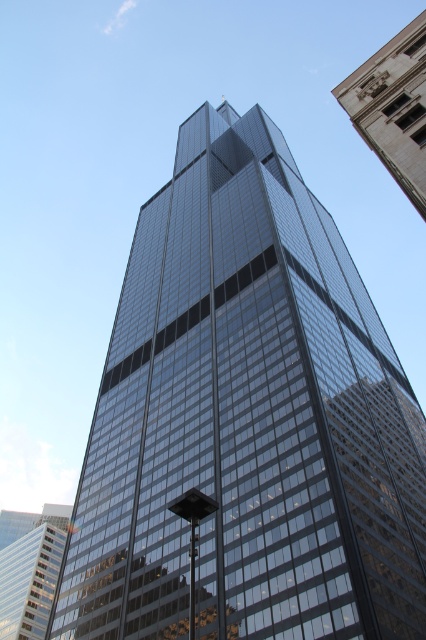
You are standing at the base of the glassy reflective skyscraper at center and looking upwards. There is a white stone building at upper right in your view. Which structure takes up more of your field of view?

The glassy reflective skyscraper at center takes up more of your field of view because it occupies more space than the white stone building at upper right according to the description.

You are standing at the base of the glassy reflective skyscraper at center and looking upwards. There is a white stone building at upper right in your view. Which building appears taller from your current position?

The white stone building at upper right appears taller than the glassy reflective skyscraper at center from your current position because it is actually taller according to the description.